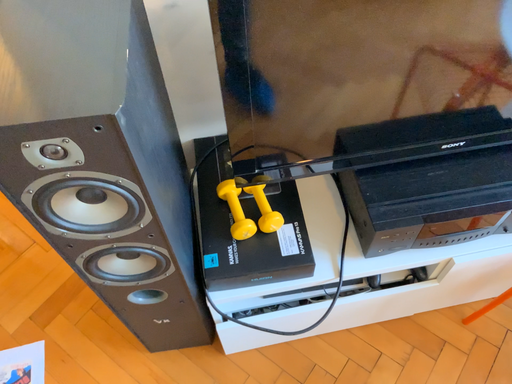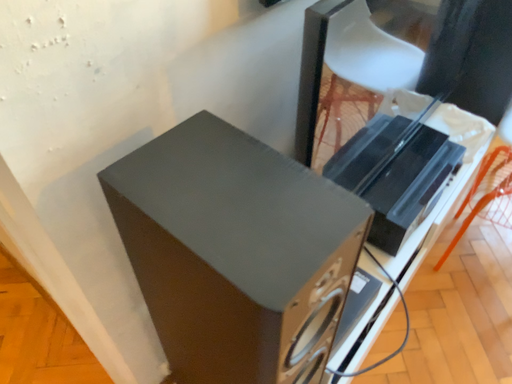
Question: Which way did the camera rotate in the video?

Choices:
 (A) rotated downward
 (B) rotated upward

Answer: (B)